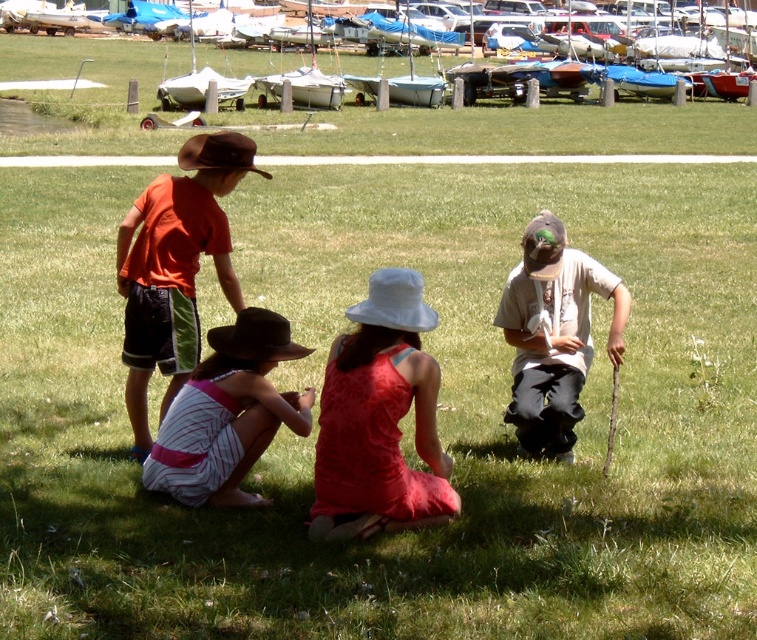
You are planning to take a photo of the matte red dress at center. To ensure it is in the frame, where should you position the camera relative to the dress?

The matte red dress at center is located at point (379, 419), so positioning the camera directly facing the center of the image will ensure the dress is in the frame.

You are standing in the grassy area and want to find the orange cotton shirt at upper left and the pink striped dress at center. Which of these two items is shorter in height?

The orange cotton shirt at upper left has a lesser height compared to the pink striped dress at center, so the orange cotton shirt at upper left is shorter in height.

You are standing in the scene and want to pick up an item located at point (131,262) and another item at point (248,392). Which item should you reach for first to minimize the distance walked?

You should reach for the item at point (131,262) first because it is closer to you than point (248,392), which is further away.